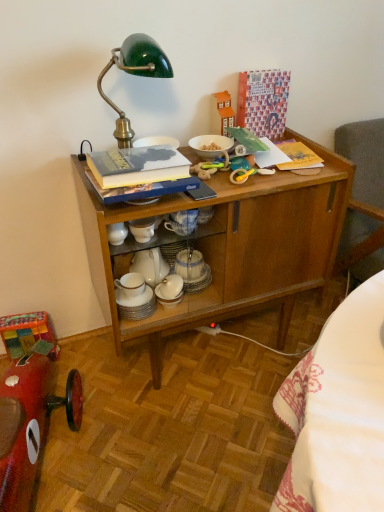
Question: Can you confirm if shiny red toy car at lower left is positioned to the left of hardcover book at upper center?

Choices:
 (A) no
 (B) yes

Answer: (B)

Question: Does shiny red toy car at lower left come behind hardcover book at upper center?

Choices:
 (A) yes
 (B) no

Answer: (B)

Question: From the image's perspective, is shiny red toy car at lower left on hardcover book at upper center?

Choices:
 (A) yes
 (B) no

Answer: (B)

Question: Can you confirm if shiny red toy car at lower left is shorter than hardcover book at upper center?

Choices:
 (A) yes
 (B) no

Answer: (B)

Question: Is shiny red toy car at lower left not close to hardcover book at upper center?

Choices:
 (A) yes
 (B) no

Answer: (B)

Question: Can you confirm if shiny red toy car at lower left is wider than hardcover book at upper center?

Choices:
 (A) yes
 (B) no

Answer: (A)

Question: Can you confirm if shiny red toy car at lower left is taller than wooden cabinet at center?

Choices:
 (A) yes
 (B) no

Answer: (B)

Question: From the image's perspective, does shiny red toy car at lower left appear lower than wooden cabinet at center?

Choices:
 (A) no
 (B) yes

Answer: (B)

Question: From a real-world perspective, is shiny red toy car at lower left located higher than wooden cabinet at center?

Choices:
 (A) no
 (B) yes

Answer: (A)

Question: Is shiny red toy car at lower left thinner than wooden cabinet at center?

Choices:
 (A) yes
 (B) no

Answer: (B)

Question: Is shiny red toy car at lower left to the right of wooden cabinet at center from the viewer's perspective?

Choices:
 (A) yes
 (B) no

Answer: (B)

Question: Can you confirm if shiny red toy car at lower left is wider than wooden cabinet at center?

Choices:
 (A) yes
 (B) no

Answer: (A)

Question: From a real-world perspective, is wooden cabinet at center positioned under white glossy bowl at upper center, arranged as the 1th tableware when viewed from the right, based on gravity?

Choices:
 (A) yes
 (B) no

Answer: (A)